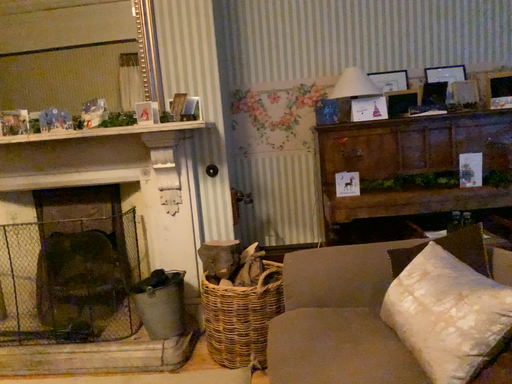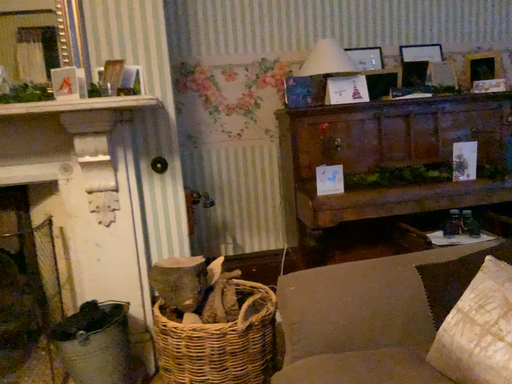
Question: How did the camera likely rotate when shooting the video?

Choices:
 (A) rotated left
 (B) rotated right

Answer: (B)